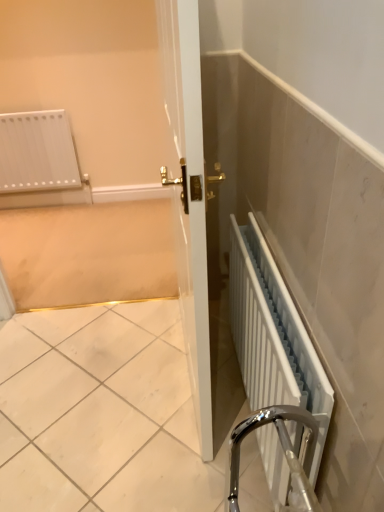
Question: From a real-world perspective, does white glossy radiator at upper left stand above white metallic radiator at lower right?

Choices:
 (A) no
 (B) yes

Answer: (B)

Question: Is white glossy radiator at upper left outside of white metallic radiator at lower right?

Choices:
 (A) no
 (B) yes

Answer: (B)

Question: Is white glossy radiator at upper left to the left of white metallic radiator at lower right from the viewer's perspective?

Choices:
 (A) no
 (B) yes

Answer: (B)

Question: Can white metallic radiator at lower right be found inside white glossy radiator at upper left?

Choices:
 (A) yes
 (B) no

Answer: (B)

Question: Can you confirm if white glossy radiator at upper left is smaller than white metallic radiator at lower right?

Choices:
 (A) yes
 (B) no

Answer: (B)

Question: Is white glossy radiator at upper left oriented away from white metallic radiator at lower right?

Choices:
 (A) no
 (B) yes

Answer: (A)

Question: From a real-world perspective, is white metallic radiator at lower right positioned under white glossy radiator at upper left based on gravity?

Choices:
 (A) yes
 (B) no

Answer: (A)

Question: Can you confirm if white metallic radiator at lower right is thinner than white glossy radiator at upper left?

Choices:
 (A) no
 (B) yes

Answer: (B)

Question: Does white metallic radiator at lower right have a greater width compared to white glossy radiator at upper left?

Choices:
 (A) yes
 (B) no

Answer: (B)

Question: From the image's perspective, is white metallic radiator at lower right beneath white glossy radiator at upper left?

Choices:
 (A) no
 (B) yes

Answer: (B)

Question: Is white metallic radiator at lower right facing away from white glossy radiator at upper left?

Choices:
 (A) yes
 (B) no

Answer: (B)

Question: Would you consider white metallic radiator at lower right to be distant from white glossy radiator at upper left?

Choices:
 (A) no
 (B) yes

Answer: (B)

Question: Visually, is white metallic radiator at lower right positioned to the left or to the right of white glossy radiator at upper left?

Choices:
 (A) right
 (B) left

Answer: (A)